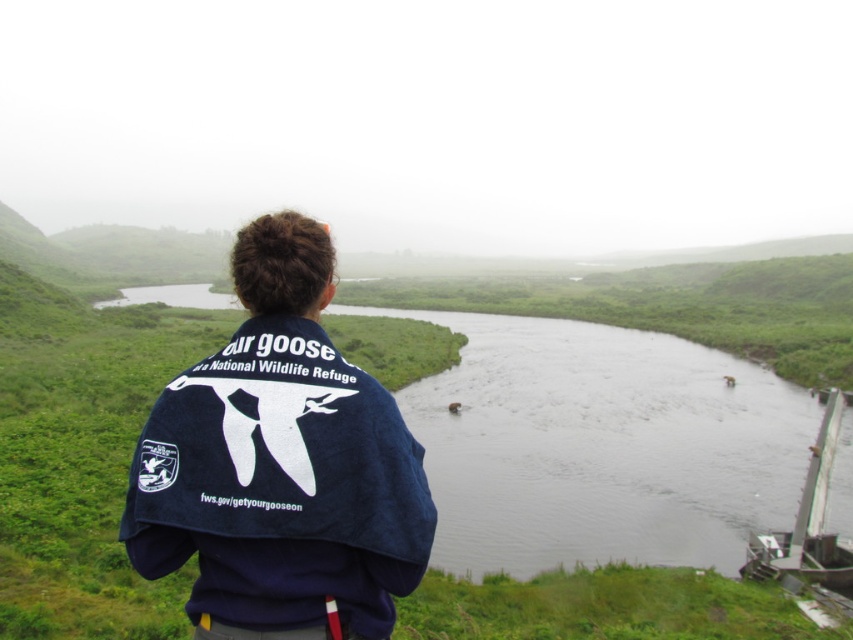
You are standing at the edge of the scene and want to throw a pebble into the dark water at center and the denim jacket at center. Which object will the pebble reach first?

The dark water at center is further to the viewer than the denim jacket at center, so the pebble will reach the denim jacket at center first.

You are a drone operator tasked with capturing aerial footage of the dark water at center and the denim jacket at center. The drone has a maximum flight radius of 30 meters. Can the drone safely capture footage of both objects without exceeding its range?

The distance between the dark water at center and the denim jacket at center is 28.44 meters. Since the drone has a maximum flight radius of 30 meters, it can safely capture footage of both objects without exceeding its range.